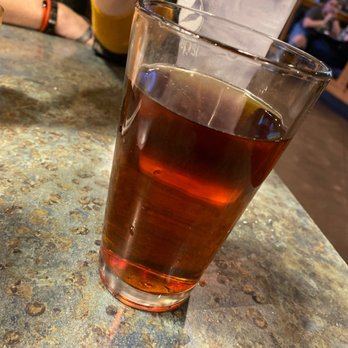
Where is `table`? This screenshot has width=348, height=348. table is located at coordinates (284, 191).